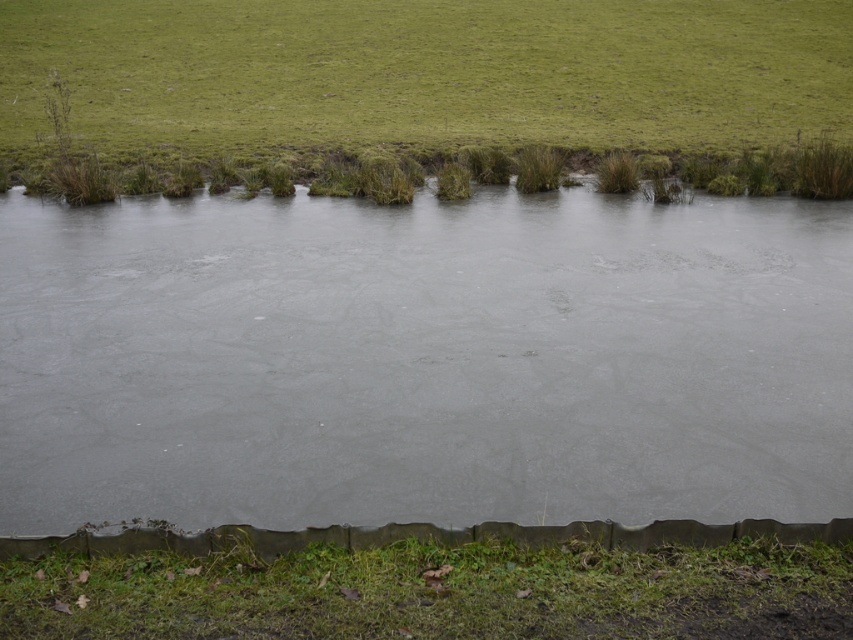
Which is behind, point (491, 280) or point (15, 604)?

Positioned behind is point (491, 280).

The image size is (853, 640). I want to click on gray matte water at center, so click(x=422, y=360).

Where is `gray matte water at center`? The height and width of the screenshot is (640, 853). gray matte water at center is located at coordinates (422, 360).

Is green grassy at upper center taller than green grassy at lower center?

Yes.

Between point (166, 90) and point (637, 588), which one is positioned behind?

Point (166, 90)

Is point (431, 67) positioned after point (19, 636)?

That is True.

The width and height of the screenshot is (853, 640). What are the coordinates of `green grassy at upper center` in the screenshot? It's located at (424, 74).

Is gray matte water at center closer to the viewer compared to green grassy at upper center?

Yes, gray matte water at center is closer to the viewer.

Can you confirm if gray matte water at center is smaller than green grassy at upper center?

Indeed, gray matte water at center has a smaller size compared to green grassy at upper center.

Identify the location of gray matte water at center. (422, 360).